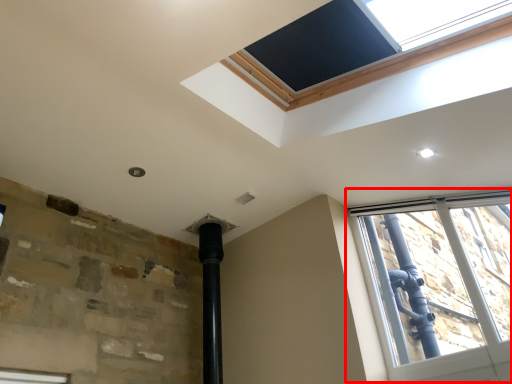
Question: From the image's perspective, what is the correct spatial positioning of window (annotated by the red box) in reference to window screen?

Choices:
 (A) above
 (B) below

Answer: (B)